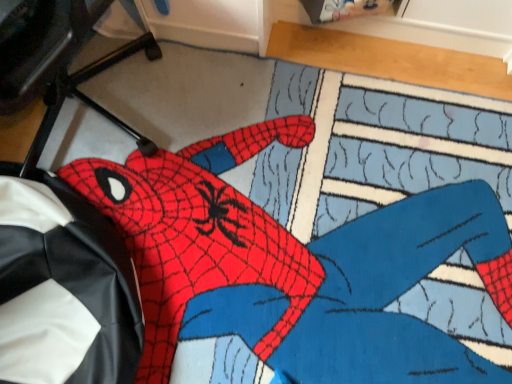
Question: Is black leather computer chair at lower left far away from black leather bean bag chair at left?

Choices:
 (A) yes
 (B) no

Answer: (B)

Question: Does black leather computer chair at lower left appear on the left side of black leather bean bag chair at left?

Choices:
 (A) yes
 (B) no

Answer: (A)

Question: Considering the relative sizes of black leather computer chair at lower left and black leather bean bag chair at left in the image provided, is black leather computer chair at lower left bigger than black leather bean bag chair at left?

Choices:
 (A) no
 (B) yes

Answer: (B)

Question: From a real-world perspective, is black leather computer chair at lower left positioned over black leather bean bag chair at left based on gravity?

Choices:
 (A) no
 (B) yes

Answer: (B)

Question: Considering the relative sizes of black leather computer chair at lower left and black leather bean bag chair at left in the image provided, is black leather computer chair at lower left taller than black leather bean bag chair at left?

Choices:
 (A) no
 (B) yes

Answer: (B)

Question: Is black leather bean bag chair at left inside the boundaries of black leather computer chair at lower left, or outside?

Choices:
 (A) inside
 (B) outside

Answer: (B)

Question: From a real-world perspective, relative to black leather computer chair at lower left, is black leather bean bag chair at left vertically above or below?

Choices:
 (A) above
 (B) below

Answer: (B)

Question: Considering the positions of black leather bean bag chair at left and black leather computer chair at lower left in the image, is black leather bean bag chair at left bigger or smaller than black leather computer chair at lower left?

Choices:
 (A) big
 (B) small

Answer: (B)

Question: Is point (30, 294) positioned closer to the camera than point (42, 39)?

Choices:
 (A) farther
 (B) closer

Answer: (A)

Question: Is black leather computer chair at lower left in front of or behind black leather bean bag chair at left in the image?

Choices:
 (A) behind
 (B) front

Answer: (B)

Question: Looking at the image, does black leather computer chair at lower left seem bigger or smaller compared to black leather bean bag chair at left?

Choices:
 (A) big
 (B) small

Answer: (A)

Question: Which is correct: black leather computer chair at lower left is inside black leather bean bag chair at left, or outside of it?

Choices:
 (A) outside
 (B) inside

Answer: (A)

Question: Looking at their shapes, would you say black leather computer chair at lower left is wider or thinner than black leather bean bag chair at left?

Choices:
 (A) wide
 (B) thin

Answer: (A)

Question: Is black leather bean bag chair at left taller or shorter than red matte spider-man figure at center?

Choices:
 (A) tall
 (B) short

Answer: (A)

Question: From a real-world perspective, relative to red matte spider-man figure at center, is black leather bean bag chair at left vertically above or below?

Choices:
 (A) above
 (B) below

Answer: (A)